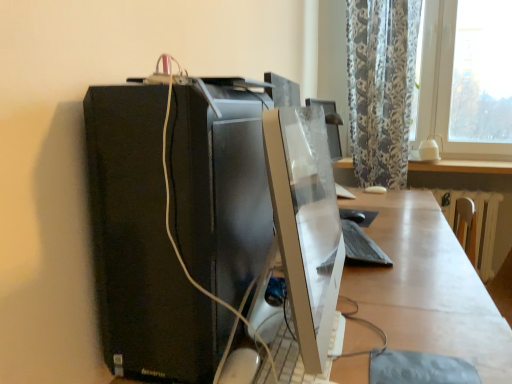
Question: Is white glossy table at lower right wider or thinner than satin white monitor at center?

Choices:
 (A) wide
 (B) thin

Answer: (A)

Question: Is white glossy table at lower right spatially inside satin white monitor at center, or outside of it?

Choices:
 (A) inside
 (B) outside

Answer: (B)

Question: Considering the real-world distances, which object is farthest from the black matte computer tower at left?

Choices:
 (A) black matte keyboard at center
 (B) white glossy table at lower right
 (C) satin white monitor at center
 (D) white glossy desk at center

Answer: (A)

Question: Estimate the real-world distances between objects in this image. Which object is closer to the black matte computer tower at left?

Choices:
 (A) white glossy desk at center
 (B) satin white monitor at center
 (C) black matte keyboard at center
 (D) white glossy table at lower right

Answer: (B)